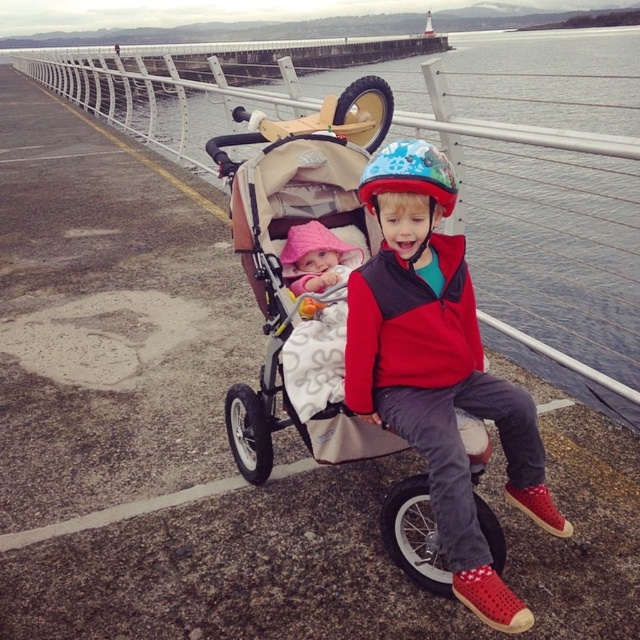
You are a pedestrian walking along the waterfront promenade and notice the red matte helmet at center and the beige fabric stroller at center. Which object is positioned to the right side from your perspective?

The red matte helmet at center is to the right of the beige fabric stroller at center, so the red matte helmet at center is positioned to the right side from your perspective.

You are a parent trying to push both the beige fabric stroller at center and the red fleece jacket at center through a narrow doorway. Which object will you need to adjust first to ensure they both fit through?

The beige fabric stroller at center is much taller than the red fleece jacket at center, so you should adjust the stroller first to lower its height or angle it to fit through the doorway before attempting to pass the jacket.

You are a parent walking along the waterfront promenade with your children. You notice the clear water at upper center and the red matte helmet at center. Which object is bigger in size?

The clear water at upper center is larger in size compared to the red matte helmet at center.